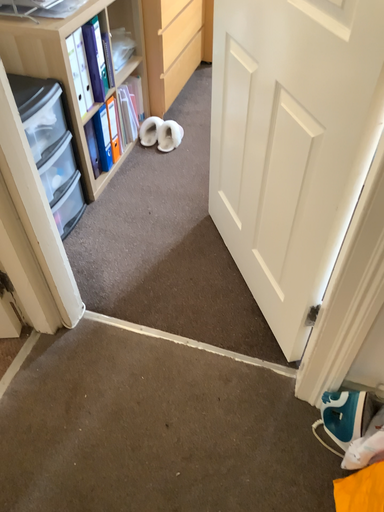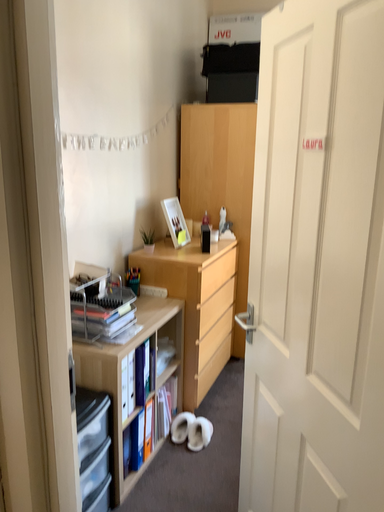
Question: How did the camera likely rotate when shooting the video?

Choices:
 (A) rotated downward
 (B) rotated upward

Answer: (B)